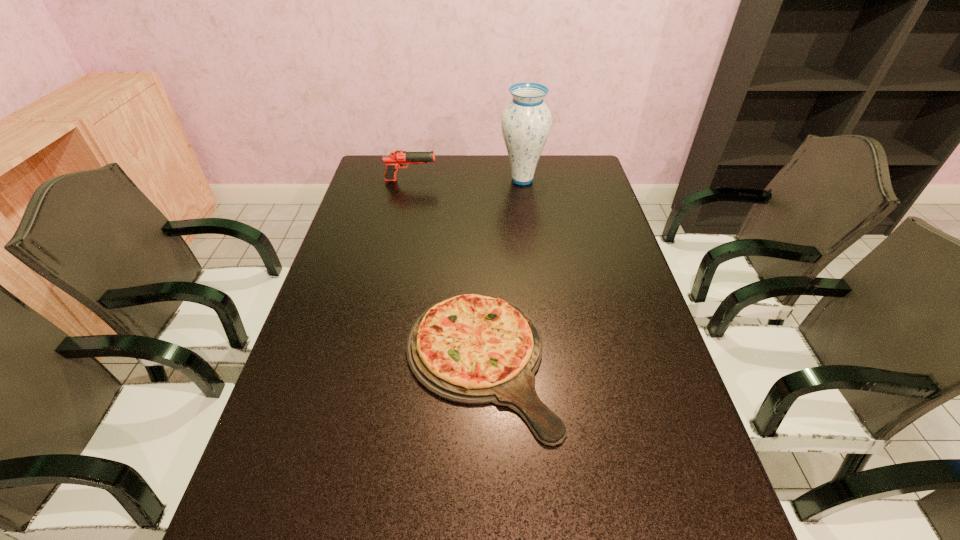
Image resolution: width=960 pixels, height=540 pixels. What are the coordinates of `vase` in the screenshot? It's located at (526, 122).

Image resolution: width=960 pixels, height=540 pixels. I want to click on gun, so click(396, 159).

Locate an element on the screen. The width and height of the screenshot is (960, 540). the shortest object is located at coordinates (472, 349).

Identify the location of the nearest object. (472, 349).

Where is `vacant space situated on the right of the tallest object`? The width and height of the screenshot is (960, 540). vacant space situated on the right of the tallest object is located at coordinates (591, 179).

At what (x,y) coordinates should I click in order to perform the action: click on vacant space located 0.280m at the aiming end of the gun. Please return your answer as a coordinate pair (x, y). The width and height of the screenshot is (960, 540). Looking at the image, I should click on (513, 180).

What are the coordinates of `free space located on the right of the shortest object` in the screenshot? It's located at (614, 361).

Where is `vase located at the far edge`? Image resolution: width=960 pixels, height=540 pixels. vase located at the far edge is located at coordinates (526, 122).

In order to click on gun that is at the far edge in this screenshot , I will do `click(396, 159)`.

You are a GUI agent. You are given a task and a screenshot of the screen. Output one action in this format:
    pyautogui.click(x=<x>, y=<y>)
    Task: Click on the object that is at the left edge
    The height and width of the screenshot is (540, 960).
    Given the screenshot: What is the action you would take?
    pyautogui.click(x=396, y=159)